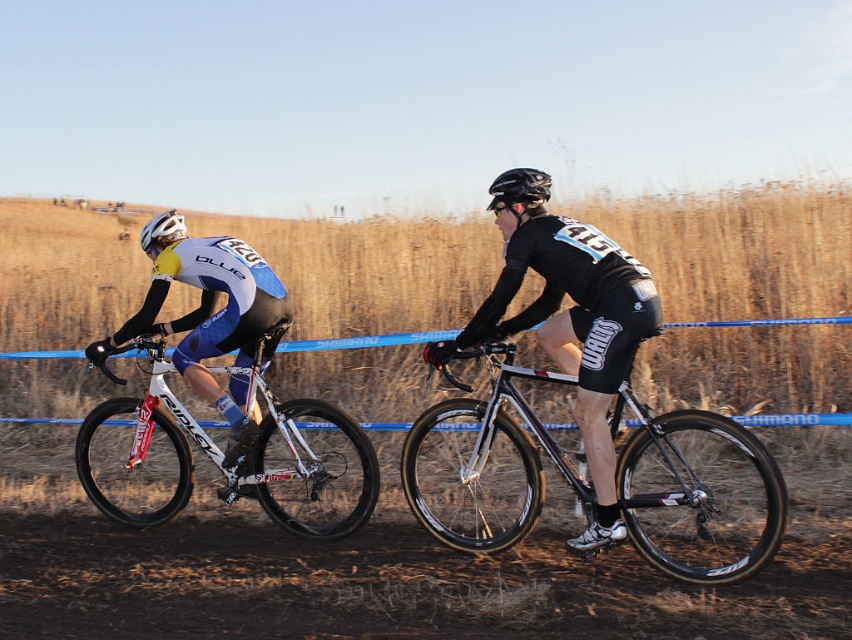
Locate an element on the screen. This screenshot has width=852, height=640. black glossy bicycle at center is located at coordinates (573, 330).

Between black glossy bicycle at center and white glossy bicycle at left, which one has more height?

black glossy bicycle at center

Is point (580, 536) closer to viewer compared to point (229, 388)?

Yes, point (580, 536) is in front of point (229, 388).

Locate an element on the screen. This screenshot has height=640, width=852. black glossy bicycle at center is located at coordinates 573,330.

Does shiny black frame at center have a lesser height compared to white glossy bicycle at left?

Yes, shiny black frame at center is shorter than white glossy bicycle at left.

Who is taller, shiny black frame at center or white glossy bicycle at left?

With more height is white glossy bicycle at left.

Where is `shiny black frame at center`? The width and height of the screenshot is (852, 640). shiny black frame at center is located at coordinates (698, 493).

Is white matte mountain bike at left below white glossy bicycle at left?

Yes.

Does white matte mountain bike at left appear on the right side of white glossy bicycle at left?

In fact, white matte mountain bike at left is to the left of white glossy bicycle at left.

In order to click on white matte mountain bike at left in this screenshot , I will do `click(223, 460)`.

Locate an element on the screen. Image resolution: width=852 pixels, height=640 pixels. white matte mountain bike at left is located at coordinates (223, 460).